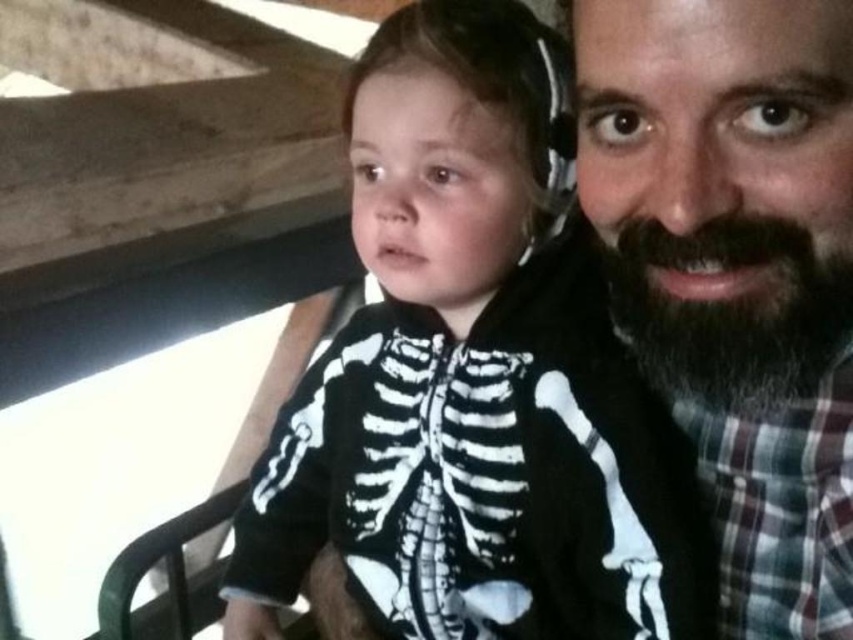
You are a photographer trying to capture a clear shot of both the black matte skeleton onesie at center and the dark brown fuzzy beard at upper right. Since you can only focus on one subject at a time, which one should you choose to ensure the other is still somewhat in focus?

The black matte skeleton onesie at center is further to the viewer than the dark brown fuzzy beard at upper right. Since the onesie is closer to you, focusing on it would keep the beard in the background somewhat in focus. Alternatively, focusing on the beard might leave the onesie slightly blurred. To maximize both being in focus, adjust focus to a point between them or use a smaller aperture for deeper depth of field.

Based on the photo, you are a photographer trying to capture a closeup of the bearded man at right and the dark brown fuzzy beard at upper right. Since the camera can only focus on one subject at a time, which one should you choose to ensure the other is still in the frame?

→ The bearded man at right is positioned on the right side of dark brown fuzzy beard at upper right, so you should focus on the dark brown fuzzy beard at upper right to ensure the bearded man at right remains in the frame.